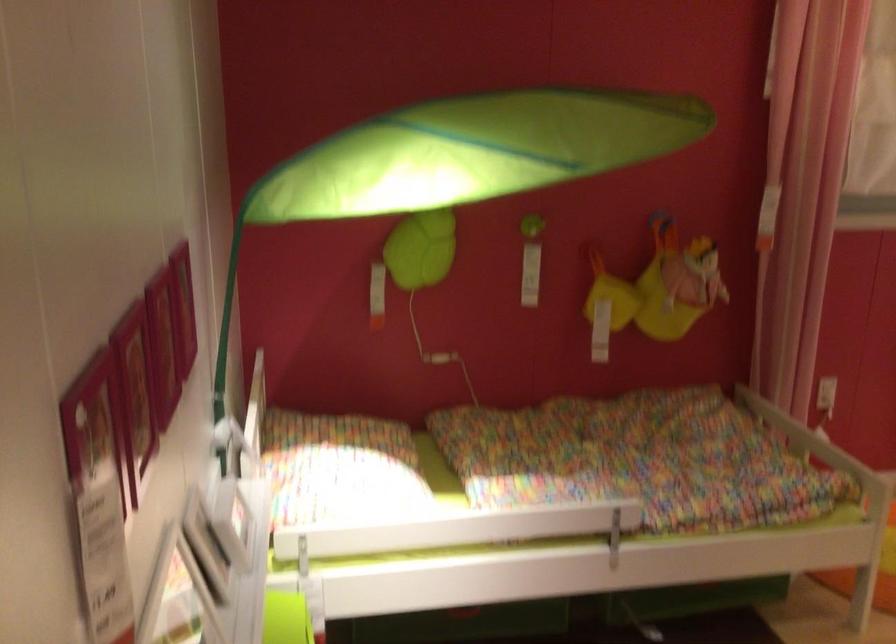
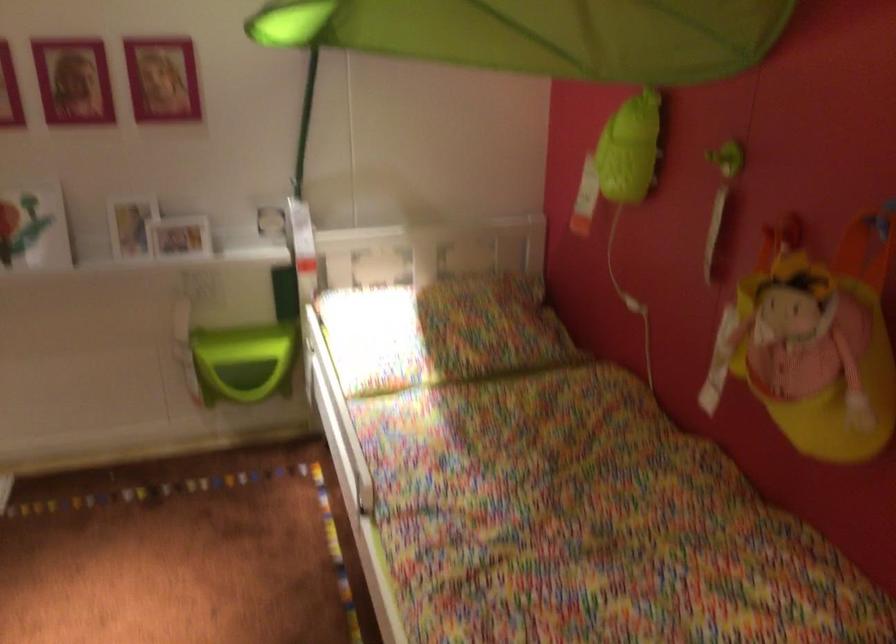
Find the pixel in the second image that matches (399,460) in the first image.

(440, 332)